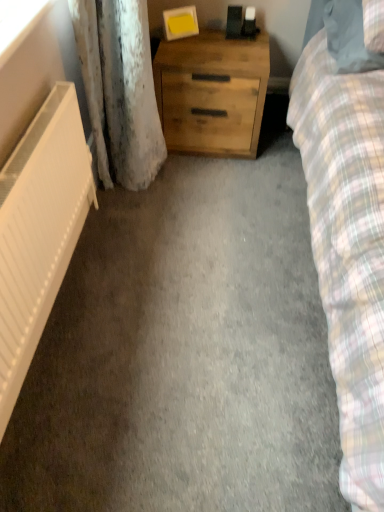
Question: Is white matte radiator at left oriented towards transparent plastic window screen at upper left?

Choices:
 (A) no
 (B) yes

Answer: (A)

Question: Is white matte radiator at left in front of transparent plastic window screen at upper left?

Choices:
 (A) no
 (B) yes

Answer: (B)

Question: Considering the relative positions of white matte radiator at left and transparent plastic window screen at upper left in the image provided, is white matte radiator at left to the right of transparent plastic window screen at upper left from the viewer's perspective?

Choices:
 (A) yes
 (B) no

Answer: (A)

Question: Is white matte radiator at left smaller than transparent plastic window screen at upper left?

Choices:
 (A) yes
 (B) no

Answer: (B)

Question: Is white matte radiator at left not inside transparent plastic window screen at upper left?

Choices:
 (A) no
 (B) yes

Answer: (B)

Question: Considering the relative sizes of white matte radiator at left and transparent plastic window screen at upper left in the image provided, is white matte radiator at left taller than transparent plastic window screen at upper left?

Choices:
 (A) no
 (B) yes

Answer: (B)

Question: Does transparent plastic window screen at upper left come in front of white matte radiator at left?

Choices:
 (A) no
 (B) yes

Answer: (A)

Question: Is transparent plastic window screen at upper left bigger than white matte radiator at left?

Choices:
 (A) yes
 (B) no

Answer: (B)

Question: Can you confirm if transparent plastic window screen at upper left is smaller than white matte radiator at left?

Choices:
 (A) yes
 (B) no

Answer: (A)

Question: Is transparent plastic window screen at upper left with white matte radiator at left?

Choices:
 (A) no
 (B) yes

Answer: (A)

Question: Considering the relative sizes of transparent plastic window screen at upper left and white matte radiator at left in the image provided, is transparent plastic window screen at upper left thinner than white matte radiator at left?

Choices:
 (A) yes
 (B) no

Answer: (B)

Question: Can you confirm if transparent plastic window screen at upper left is wider than white matte radiator at left?

Choices:
 (A) no
 (B) yes

Answer: (B)

Question: From a real-world perspective, is white matte radiator at left located higher than natural wood chest of drawers at center?

Choices:
 (A) yes
 (B) no

Answer: (B)